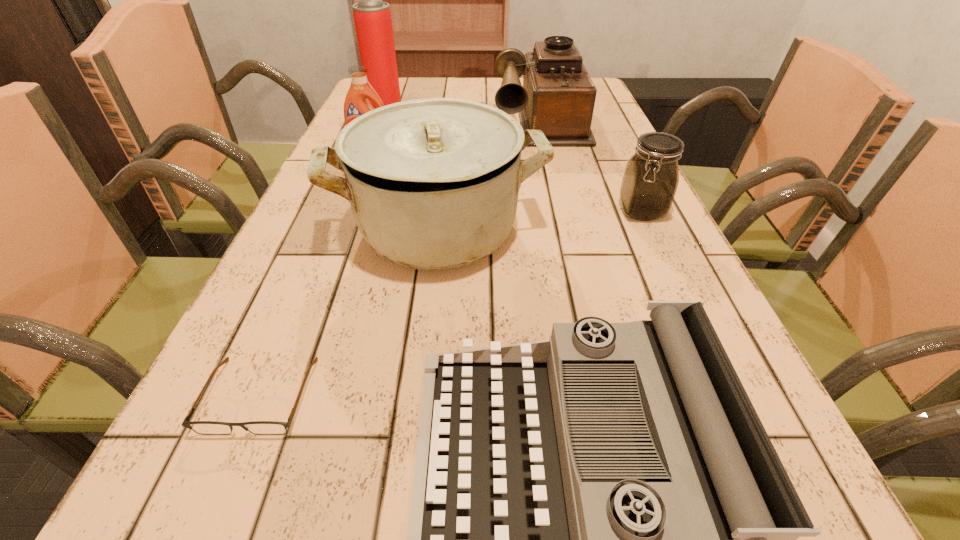
Locate an element on the screen. This screenshot has height=540, width=960. free space located 0.370m on the lid of the jar is located at coordinates (722, 385).

Where is `free space located on the front-facing side of the shortest object`? The image size is (960, 540). free space located on the front-facing side of the shortest object is located at coordinates (223, 484).

Where is `aerosol can that is at the far edge`? The image size is (960, 540). aerosol can that is at the far edge is located at coordinates (372, 17).

The height and width of the screenshot is (540, 960). Identify the location of phonograph_record at the far edge. (558, 96).

This screenshot has height=540, width=960. What are the coordinates of `aerosol can that is at the left edge` in the screenshot? It's located at (372, 17).

The height and width of the screenshot is (540, 960). In order to click on saucepan situated at the left edge in this screenshot , I will do `click(433, 183)`.

You are a GUI agent. You are given a task and a screenshot of the screen. Output one action in this format:
    pyautogui.click(x=<x>, y=<y>)
    Task: Click on the detergent present at the left edge
    The width and height of the screenshot is (960, 540).
    Given the screenshot: What is the action you would take?
    pyautogui.click(x=356, y=103)

At what (x,y) coordinates should I click in order to perform the action: click on spectacles positioned at the left edge. Please return your answer as a coordinate pair (x, y). Looking at the image, I should click on (200, 427).

Identify the location of phonograph_record that is at the right edge. Image resolution: width=960 pixels, height=540 pixels. (558, 96).

The image size is (960, 540). What are the coordinates of `jar at the right edge` in the screenshot? It's located at (649, 184).